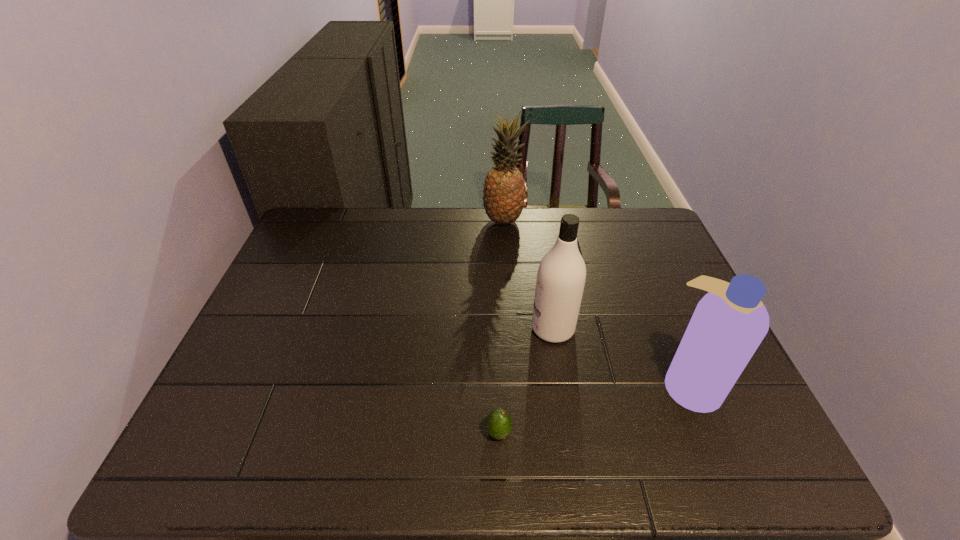
At what (x,y) coordinates should I click in order to perform the action: click on vacant area situated 0.150m on the front-facing side of the left shampoo. Please return your answer as a coordinate pair (x, y). The height and width of the screenshot is (540, 960). Looking at the image, I should click on (473, 329).

The width and height of the screenshot is (960, 540). I want to click on vacant space located on the left of the rightmost object, so click(547, 384).

Locate an element on the screen. The image size is (960, 540). free space located on the back of the avocado is located at coordinates (495, 348).

Locate an element on the screen. The image size is (960, 540). object that is at the far edge is located at coordinates (504, 190).

Locate an element on the screen. The width and height of the screenshot is (960, 540). object present at the near edge is located at coordinates (498, 425).

I want to click on object located at the right edge, so click(x=729, y=323).

In the image, there is a desktop. Identify the location of vacant space at the far edge. Image resolution: width=960 pixels, height=540 pixels. (468, 221).

The image size is (960, 540). Find the location of `vacant space at the near edge`. vacant space at the near edge is located at coordinates (324, 449).

Where is `vacant space at the left edge of the desktop`? vacant space at the left edge of the desktop is located at coordinates (259, 416).

What are the coordinates of `free location at the right edge` in the screenshot? It's located at (660, 318).